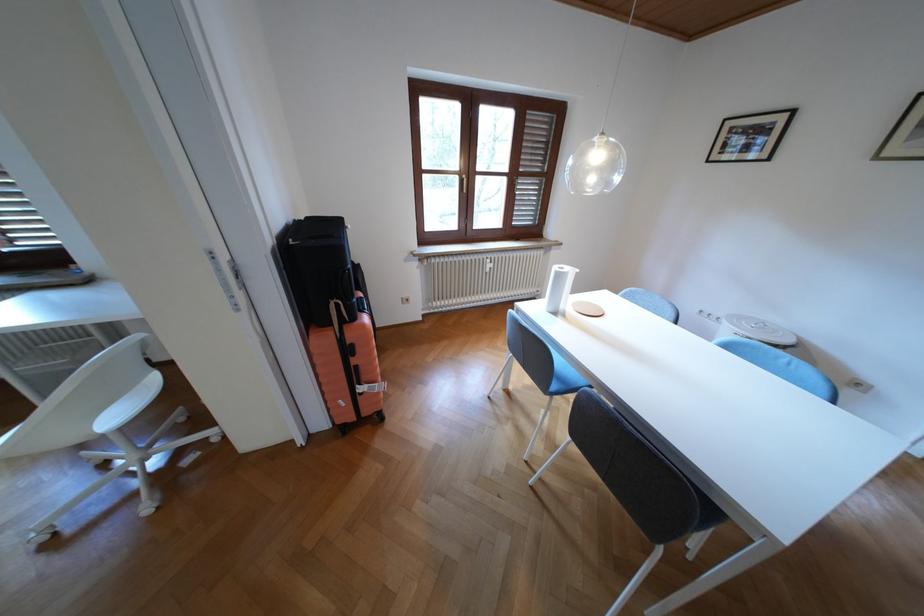
Where is `suitcase handle`? Image resolution: width=924 pixels, height=616 pixels. suitcase handle is located at coordinates (357, 378).